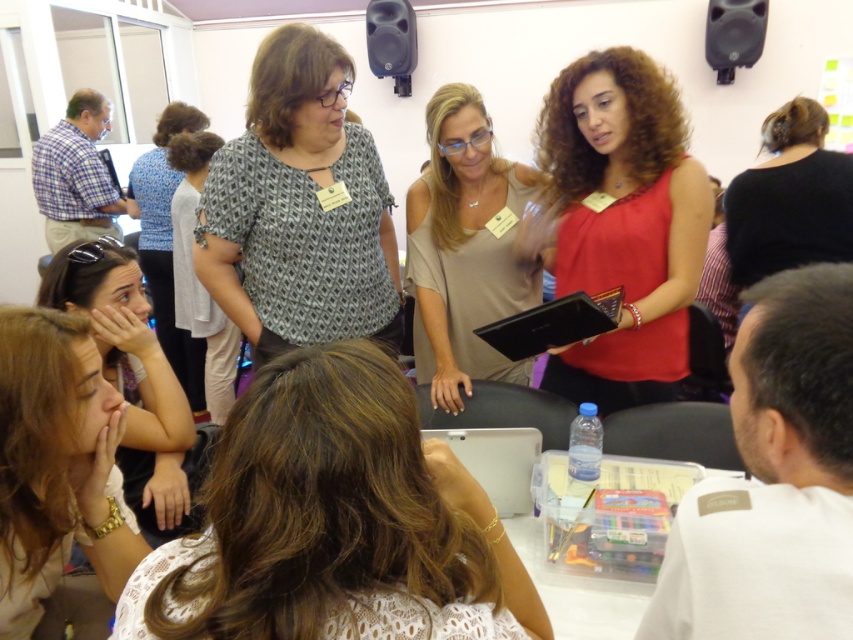
Question: Considering the real-world distances, which object is closest to the light brown hair at lower left?

Choices:
 (A) black plastic speaker at upper right
 (B) white lace shirt at center
 (C) patterned fabric blouse at center
 (D) light gray fabric shirt at center

Answer: (B)

Question: Does patterned fabric blouse at center appear under light gray fabric shirt at center?

Choices:
 (A) yes
 (B) no

Answer: (B)

Question: Is matte red tank top at center to the left of blonde hair at lower left from the viewer's perspective?

Choices:
 (A) no
 (B) yes

Answer: (A)

Question: Based on their relative distances, which object is nearer to the black plastic speaker at upper right?

Choices:
 (A) blonde hair at lower left
 (B) black matte hair at upper right

Answer: (B)

Question: Does matte red tank top at center appear over blonde hair at lower left?

Choices:
 (A) yes
 (B) no

Answer: (A)

Question: Which point is farther from the camera taking this photo?

Choices:
 (A) (450, 193)
 (B) (328, 284)
 (C) (225, 410)

Answer: (C)